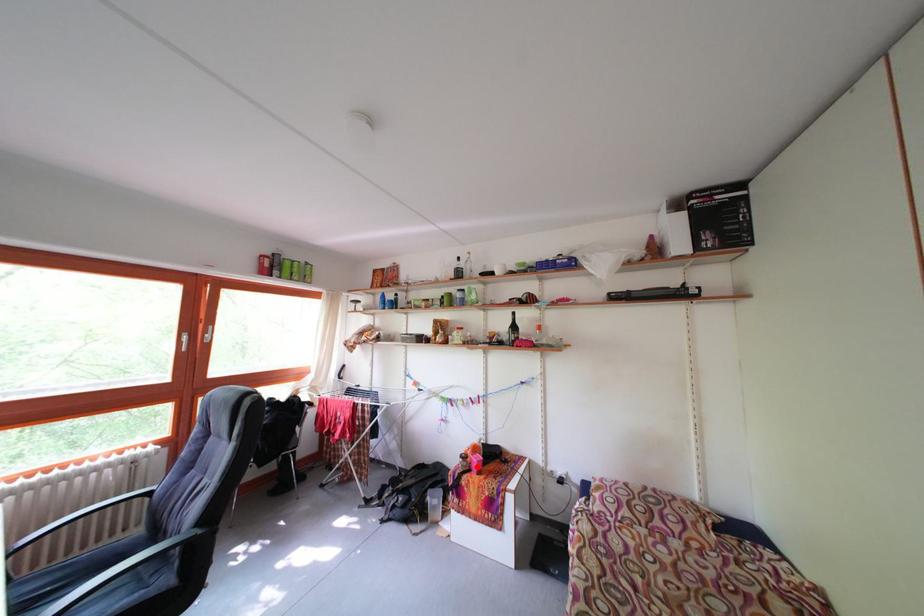
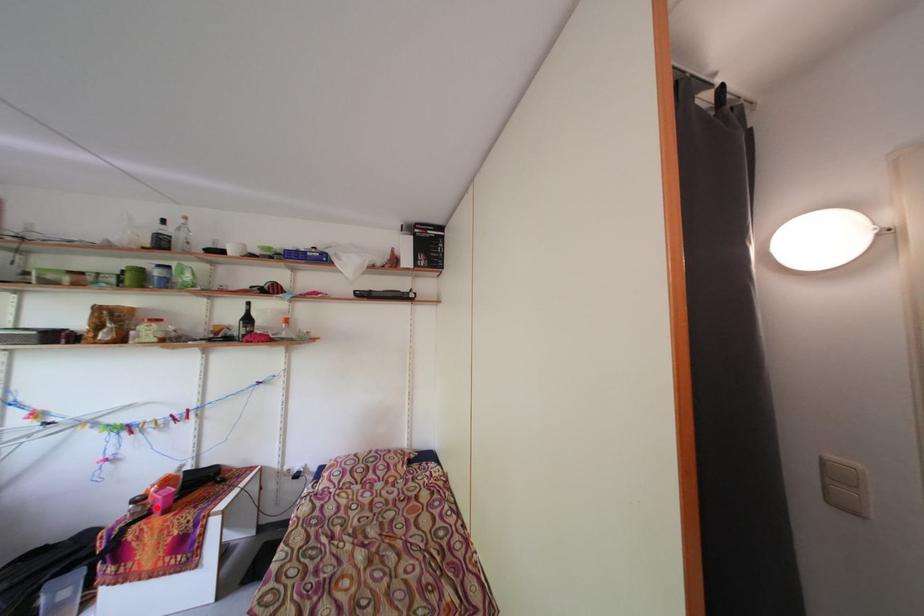
I am providing you with two images of the same scene from different viewpoints. A red point is marked on the first image and another point is marked on the second image. Is the red point in image1 aligned with the point shown in image2?

Yes